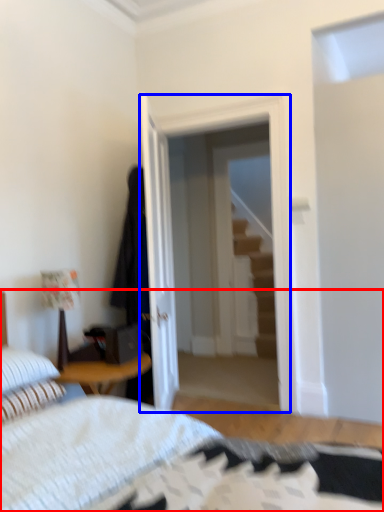
Question: Which point is further to the camera, bed (highlighted by a red box) or glass door (highlighted by a blue box)?

Choices:
 (A) bed
 (B) glass door

Answer: (B)